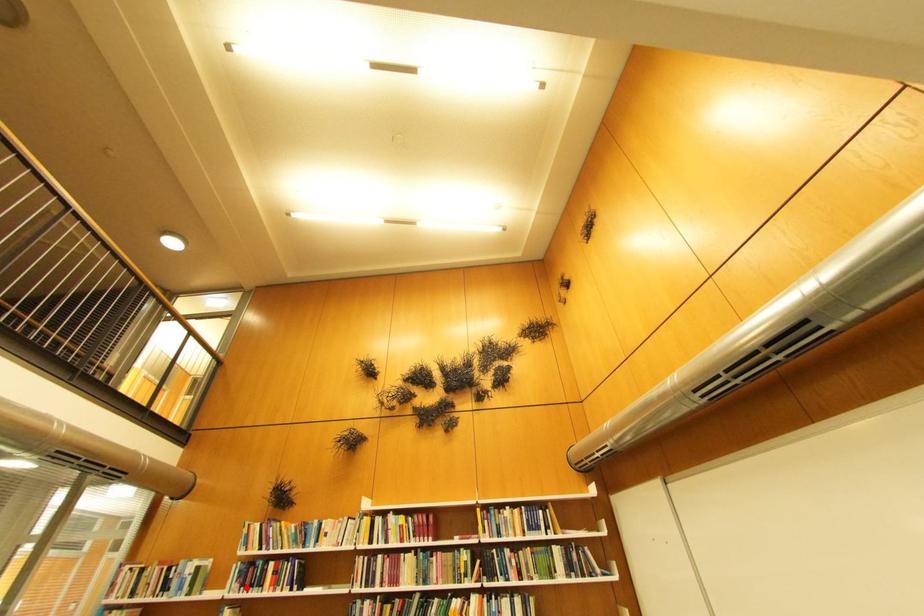
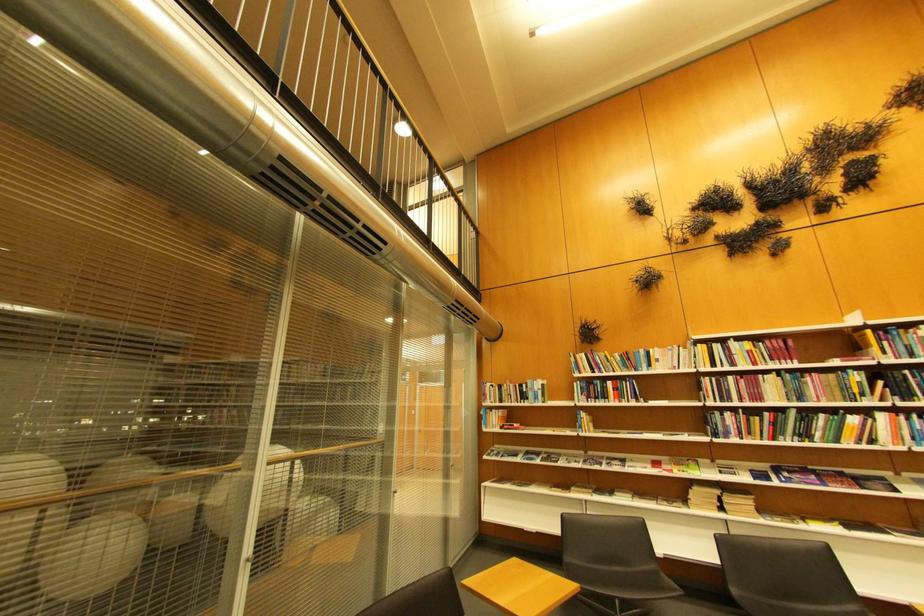
Find the pixel in the second image that matches the highlighted location in the first image.

(594, 399)